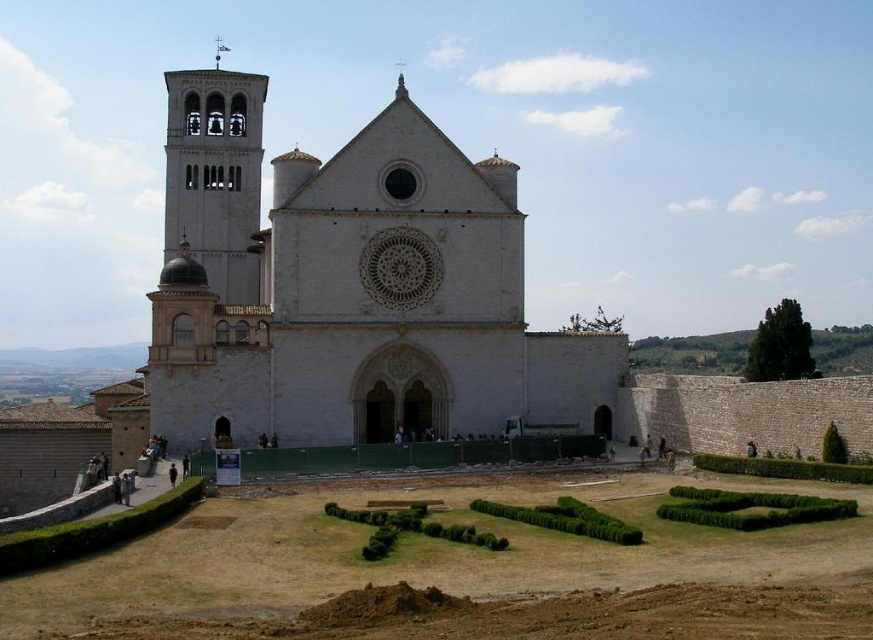
You are a landscape architect designing a garden path that needs to pass between the white stone bell tower at left and the green bushy hedge at lower center. Based on their widths, which side of the path should be closer to which object to ensure the path is wide enough for a 2.5 meter wide cart?

The white stone bell tower at left is wider than the green bushy hedge at lower center. To ensure the path is wide enough for a 2.5 meter wide cart, the path should be closer to the narrower green bushy hedge at lower center so that the wider side allows sufficient space for the cart to pass.

You are standing at the entrance of the grand historic church and want to locate the white stone bell tower at left. Based on the coordinates provided, in which direction should you look to find it?

The white stone bell tower at left is located at coordinates point (x=215, y=179), which means it is positioned to the left side of the scene. Therefore, you should look to your left to find it.